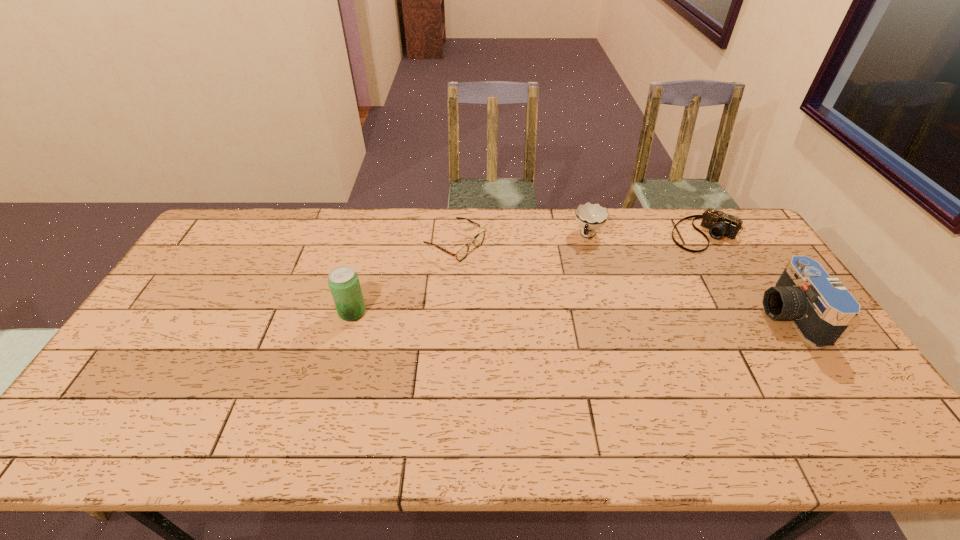
Where is `blank space located on the side of the third shortest object with the handle`? The image size is (960, 540). blank space located on the side of the third shortest object with the handle is located at coordinates (557, 316).

In order to click on spectacles that is at the far edge in this screenshot , I will do `click(462, 252)`.

Locate an element on the screen. This screenshot has width=960, height=540. camera that is positioned at the far edge is located at coordinates (719, 224).

In order to click on cup that is at the far edge in this screenshot , I will do `click(590, 217)`.

The image size is (960, 540). Find the location of `object located in the far right corner section of the desktop`. object located in the far right corner section of the desktop is located at coordinates (719, 224).

I want to click on vacant region at the far edge of the desktop, so click(525, 231).

Identify the location of vacant region at the near edge of the desktop. The image size is (960, 540). (762, 399).

This screenshot has width=960, height=540. In the image, there is a desktop. In order to click on free space at the left edge in this screenshot , I will do `click(161, 359)`.

I want to click on free space at the far left corner of the desktop, so click(x=245, y=251).

In the image, there is a desktop. Where is `free region at the near left corner`? free region at the near left corner is located at coordinates (122, 395).